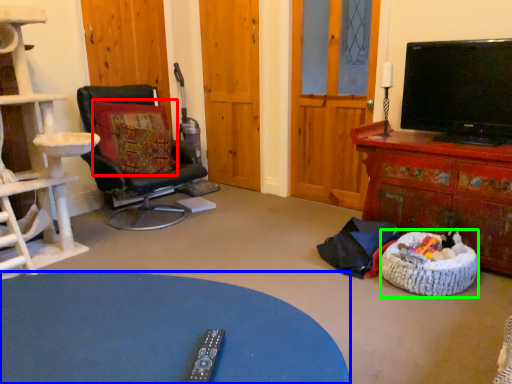
Question: Considering the real-world distances, which object is farthest from pillow (highlighted by a red box)? desk (highlighted by a blue box) or dog bed (highlighted by a green box)?

Choices:
 (A) desk
 (B) dog bed

Answer: (A)